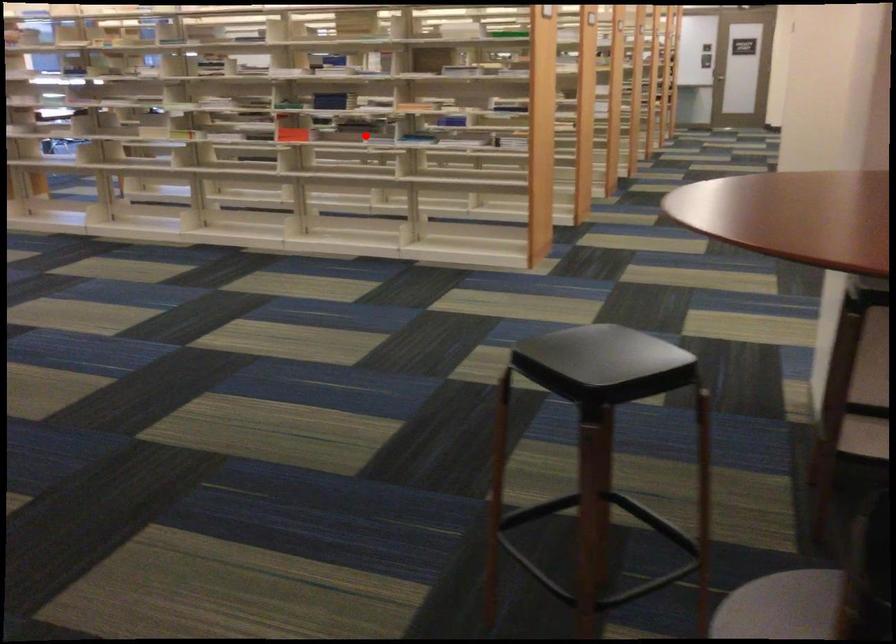
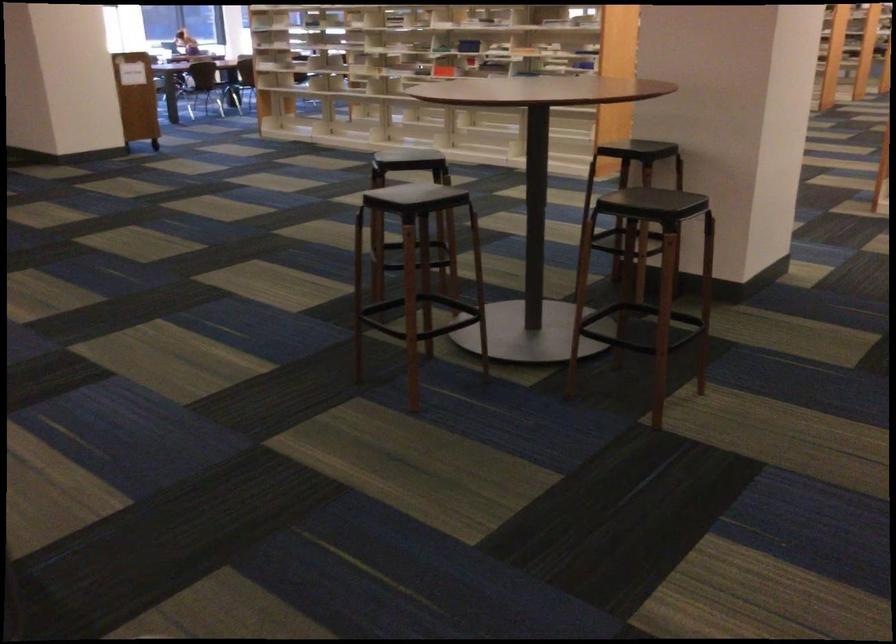
Question: I am providing you with two images of the same scene from different viewpoints. A red point is shown in image1. For the corresponding object point in image2, is it positioned nearer or farther from the camera?

Choices:
 (A) Nearer
 (B) Farther

Answer: (B)